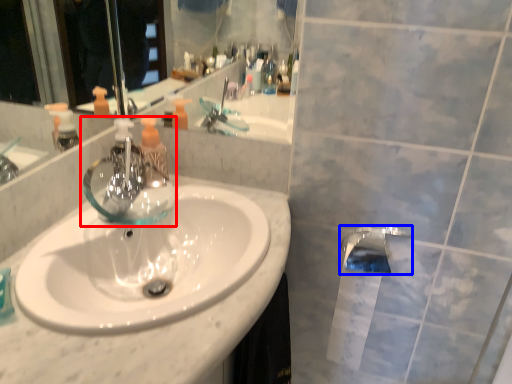
Question: Which of the following is the closest to the observer, tap (highlighted by a red box) or tap (highlighted by a blue box)?

Choices:
 (A) tap
 (B) tap

Answer: (A)